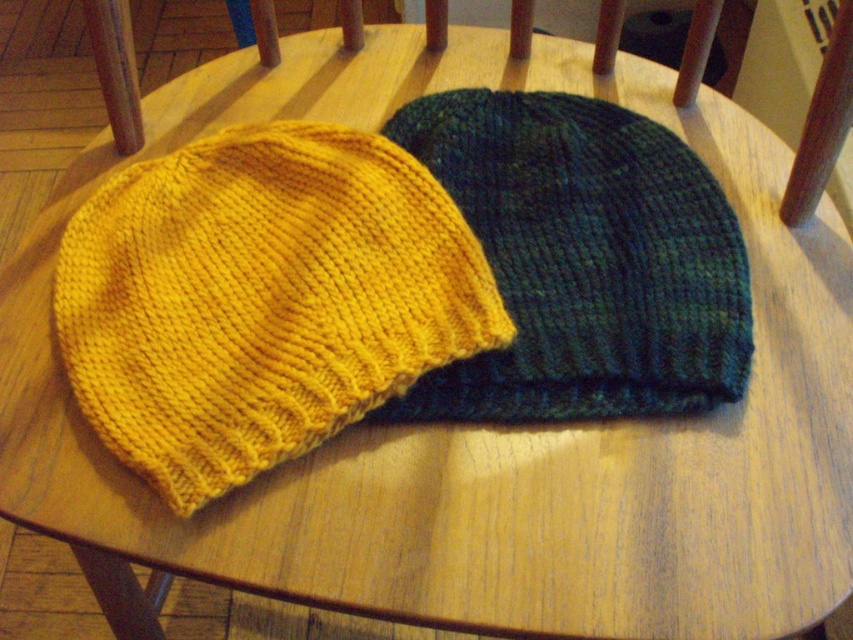
Question: Can you confirm if yellow knitted hat at center is positioned to the right of dark green knitted hat at center?

Choices:
 (A) no
 (B) yes

Answer: (A)

Question: Which object is closer to the camera taking this photo?

Choices:
 (A) yellow knitted hat at center
 (B) dark green knitted hat at center

Answer: (A)

Question: Which object is closer to the camera taking this photo?

Choices:
 (A) dark green knitted hat at center
 (B) yellow knitted hat at center

Answer: (B)

Question: Can you confirm if yellow knitted hat at center is wider than dark green knitted hat at center?

Choices:
 (A) yes
 (B) no

Answer: (A)

Question: Does yellow knitted hat at center appear under dark green knitted hat at center?

Choices:
 (A) yes
 (B) no

Answer: (A)